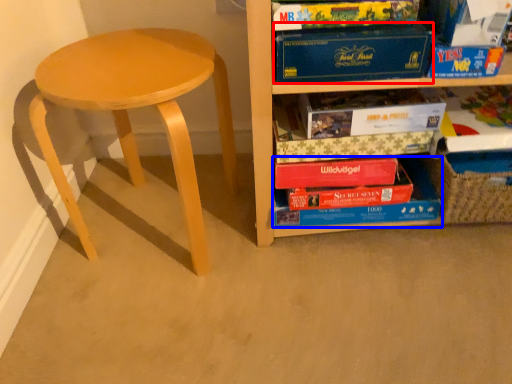
Question: Which object appears farthest to the camera in this image, paperback book (highlighted by a red box) or book (highlighted by a blue box)?

Choices:
 (A) paperback book
 (B) book

Answer: (B)